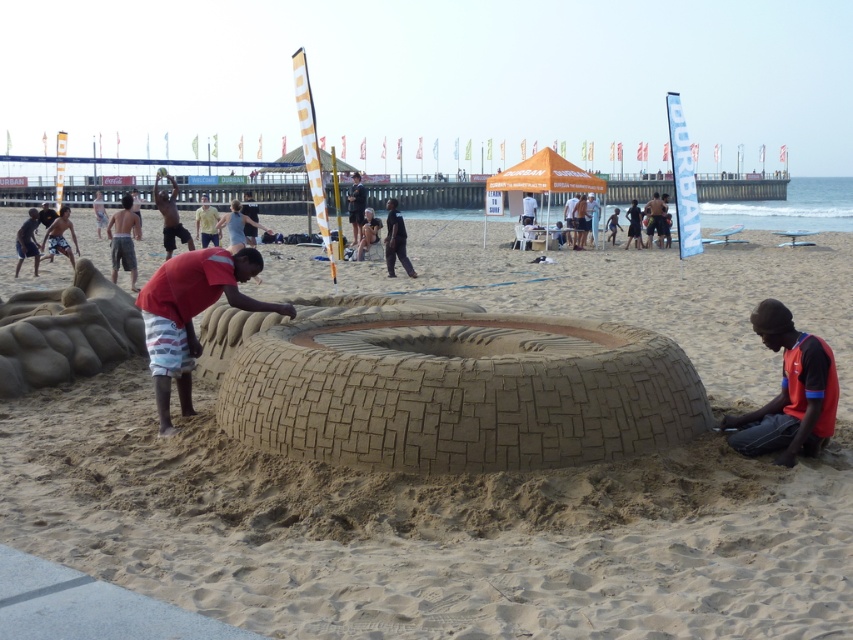
You are standing on the beach and see the light yellow fabric shirt at center and the black fabric person at center. Which one is positioned more to the left?

The light yellow fabric shirt at center is positioned to the left of the black fabric person at center.

You are standing at the beach and want to walk from the point marked at coordinates point [788,442] to the point marked at coordinates point [129,224]. Based on the scene description, will you have to walk towards the sand sculpture or away from it?

Since point [788,442] is in front of point [129,224], you would be walking away from the sand sculpture towards the background of the image.

You are a photographer standing at the edge of the beach. You want to take a photo of the brown sand sculpture at center and the light yellow fabric shirt at center so that the sculpture appears to the left of the shirt in the photo. Is this possible based on their current positions?

The brown sand sculpture at center is positioned on the right side of light yellow fabric shirt at center. To have the sculpture appear to the left of the shirt in the photo, you would need to adjust their positions or your camera angle, as their current arrangement has the sculpture to the right of the shirt.